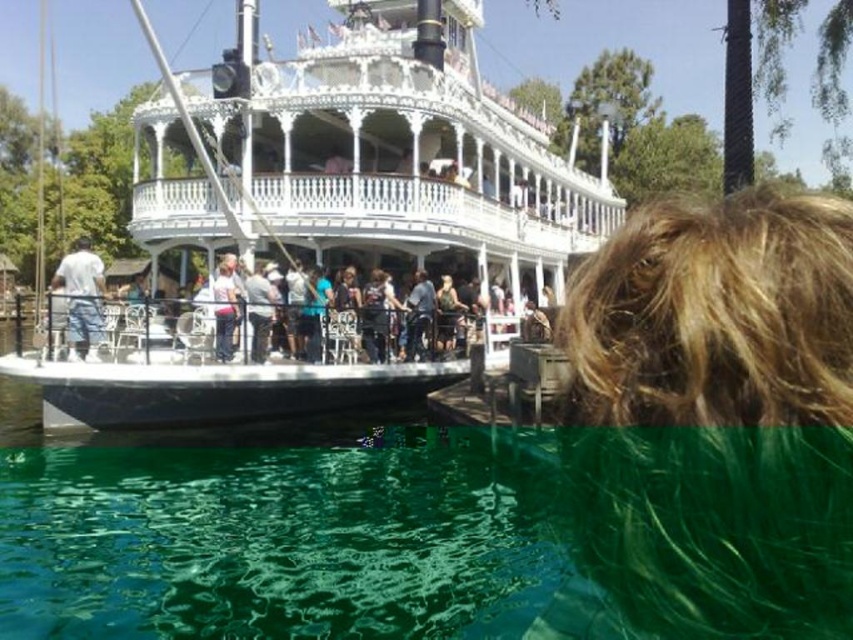
Question: Which point appears farthest from the camera in this image?

Choices:
 (A) (78, 336)
 (B) (601, 342)
 (C) (416, 140)

Answer: (C)

Question: Estimate the real-world distances between objects in this image. Which object is farther from the blonde hair at upper right?

Choices:
 (A) white cotton shirt at left
 (B) white wooden boat at center

Answer: (A)

Question: Does blonde hair at upper right appear under white cotton shirt at left?

Choices:
 (A) no
 (B) yes

Answer: (B)

Question: Which of the following is the farthest from the observer?

Choices:
 (A) (86, 292)
 (B) (157, 266)

Answer: (B)

Question: Where is blonde hair at upper right located in relation to white cotton shirt at left in the image?

Choices:
 (A) left
 (B) right

Answer: (B)

Question: Does blonde hair at upper right have a greater width compared to white cotton shirt at left?

Choices:
 (A) no
 (B) yes

Answer: (A)